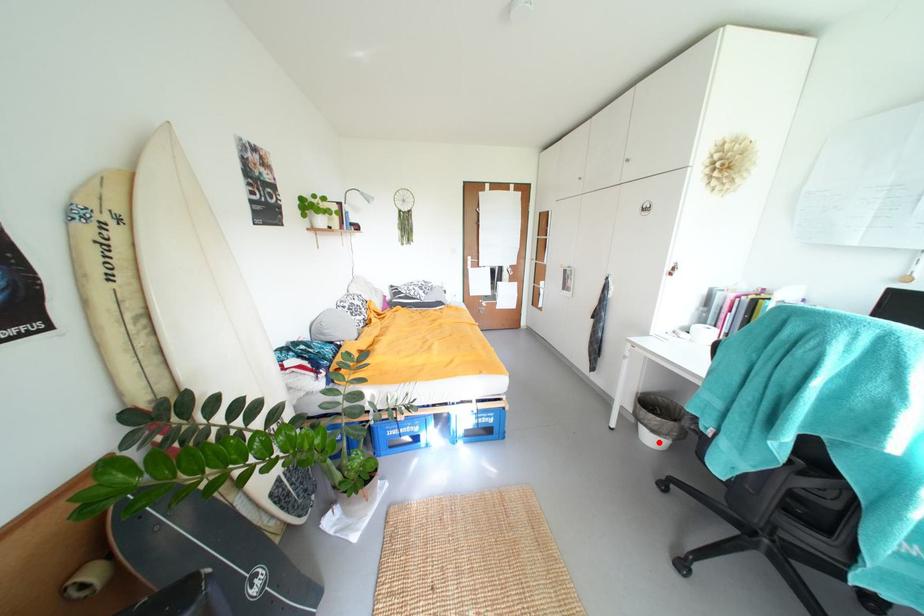
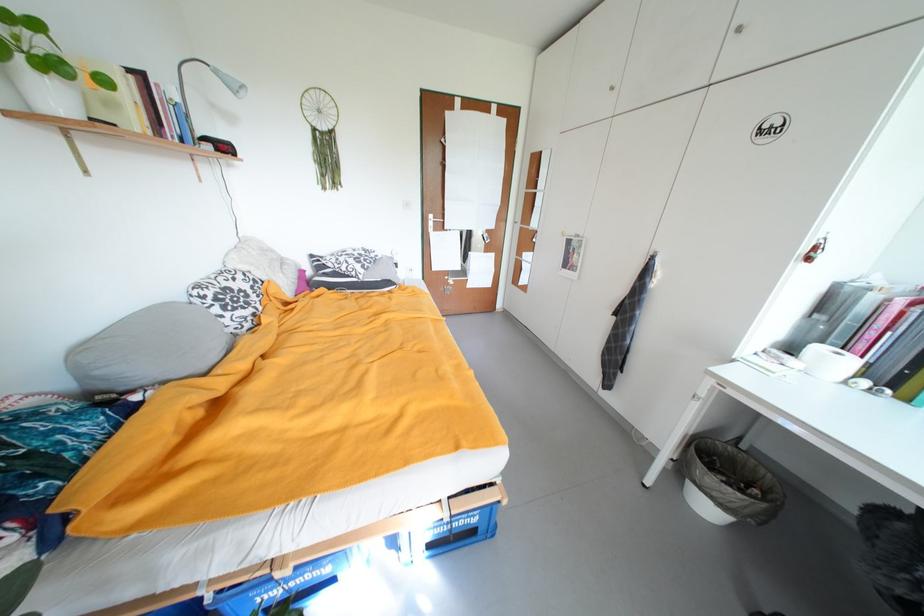
Question: A red point is marked in image1. In image2, is the corresponding 3D point closer to the camera or farther? Reply with the corresponding letter.

Choices:
 (A) The corresponding 3D point is closer.
 (B) The corresponding 3D point is farther.

Answer: (B)